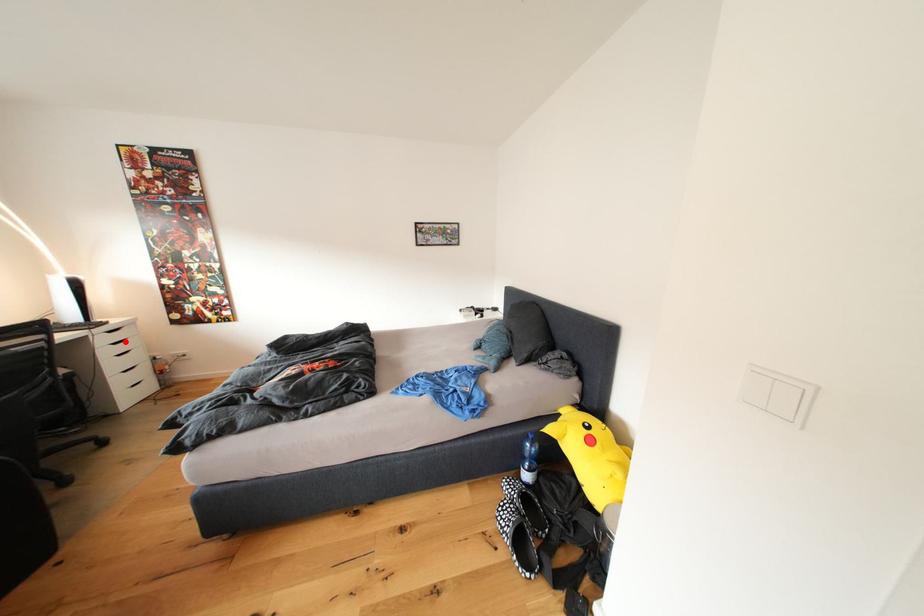
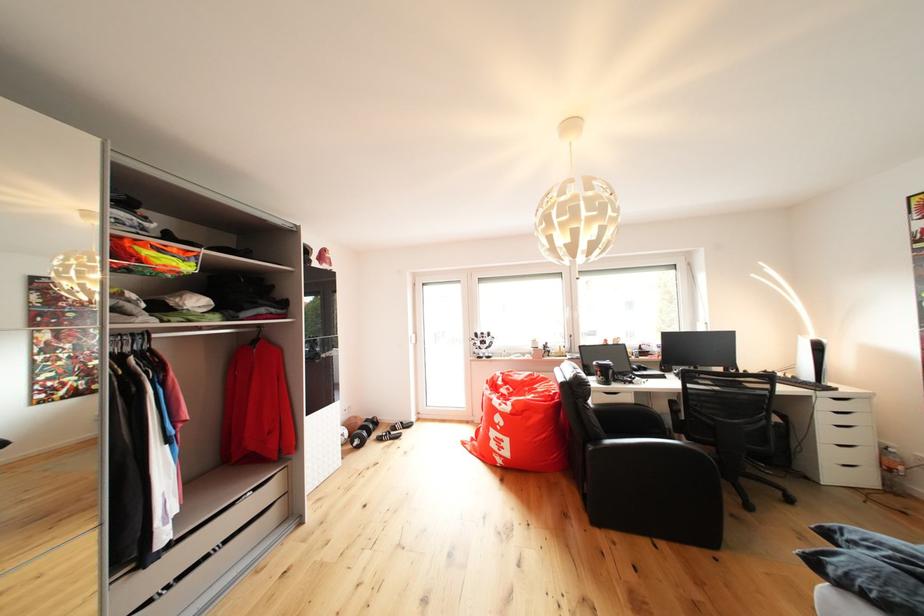
The point at the highlighted location is marked in the first image. Where is the corresponding point in the second image?

(850, 411)